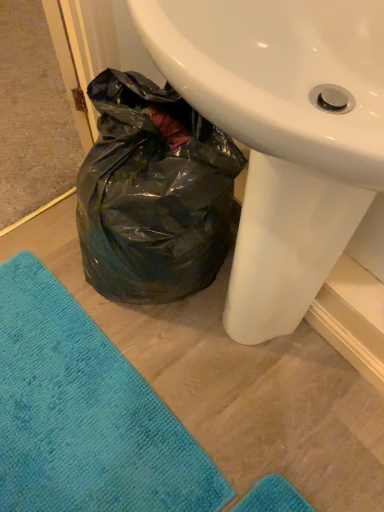
This screenshot has height=512, width=384. What are the coordinates of `vacant location below white glossy sink at center (from a real-world perspective)` in the screenshot? It's located at (248, 352).